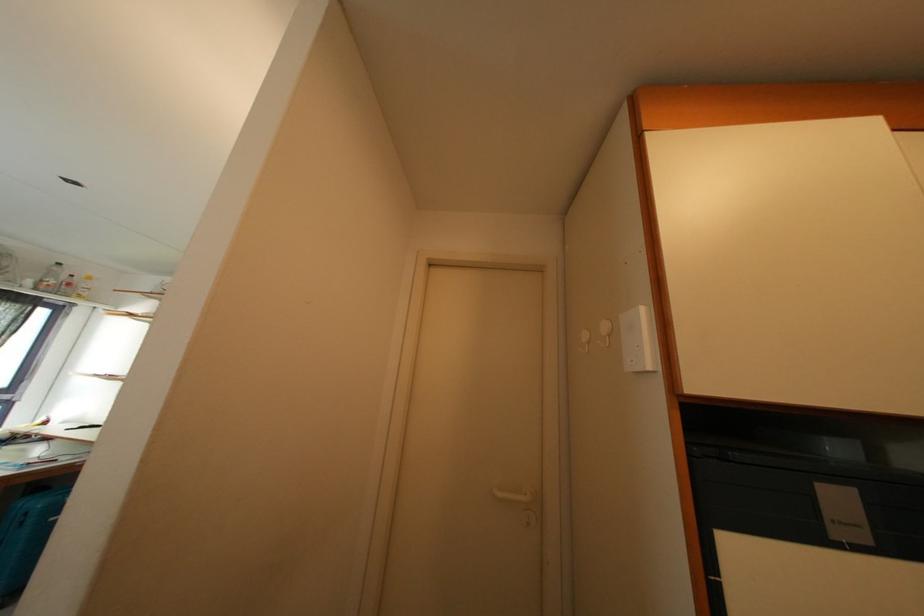
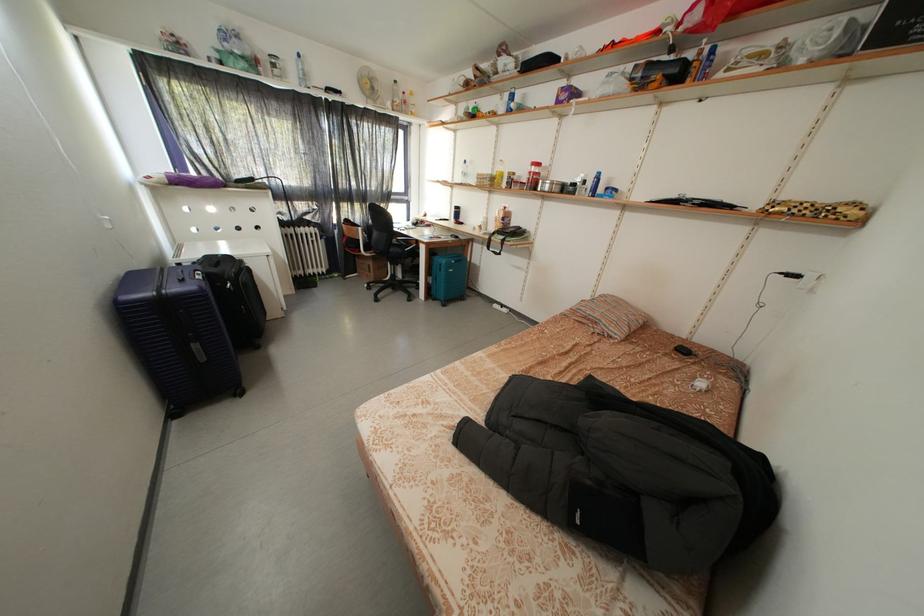
The images are taken continuously from a first-person perspective. In which direction is your viewpoint rotating?

The camera's rotation is toward left-down.